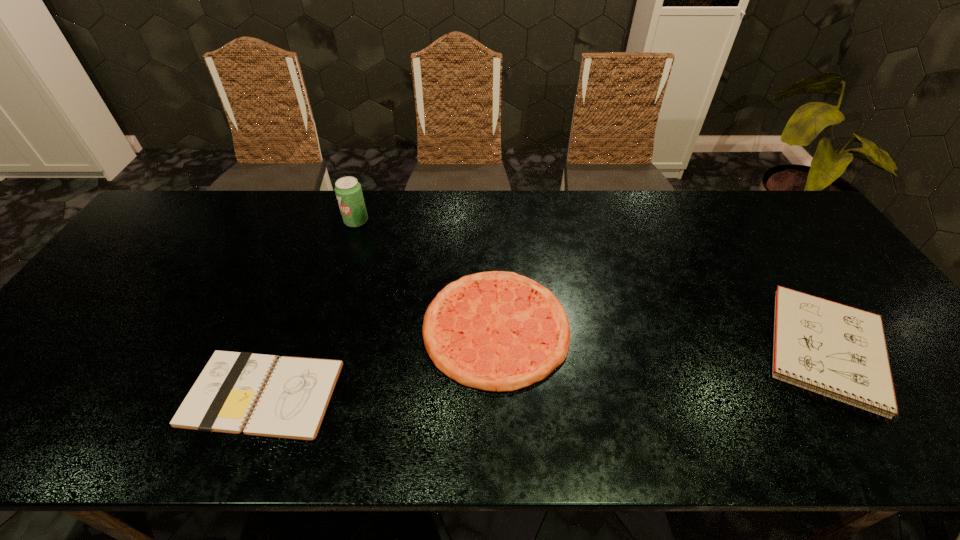
I want to click on free spot that satisfies the following two spatial constraints: 1. on the back side of the shortest object; 2. on the left side of the third object from left to right, so click(x=288, y=327).

Find the location of a particular element. The width and height of the screenshot is (960, 540). vacant position in the image that satisfies the following two spatial constraints: 1. on the front side of the farthest object; 2. on the left side of the second object from right to left is located at coordinates (324, 327).